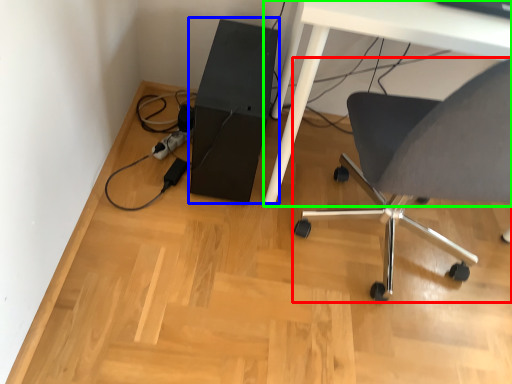
Question: Which object is positioned farthest from chair (highlighted by a red box)? Select from computer tower (highlighted by a blue box) and table (highlighted by a green box).

Choices:
 (A) computer tower
 (B) table

Answer: (A)